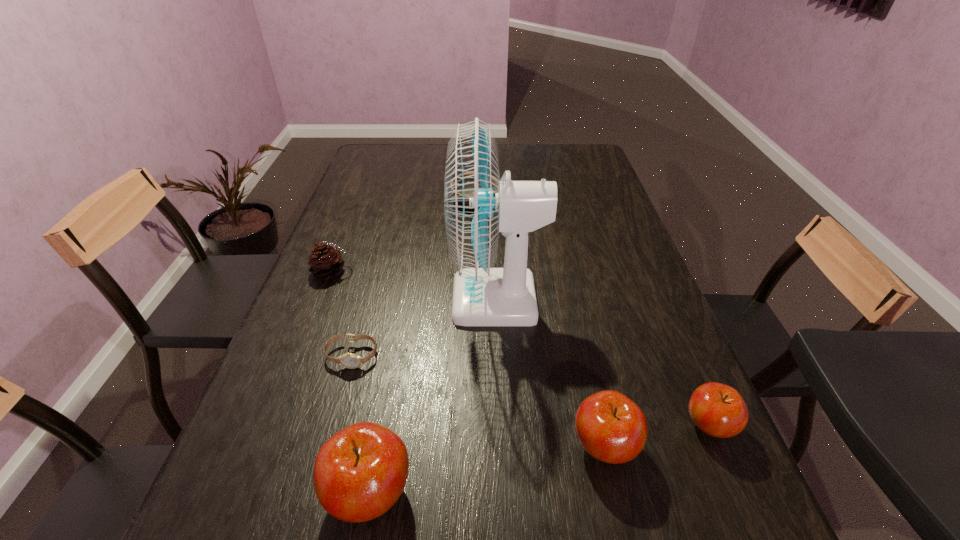
Find the location of `the tallest apple`. the tallest apple is located at coordinates (360, 472).

Where is `the second tallest object`? the second tallest object is located at coordinates (360, 472).

This screenshot has height=540, width=960. In order to click on the second object from right to left in this screenshot , I will do `click(612, 428)`.

Where is `the second apple from left to right`? This screenshot has width=960, height=540. the second apple from left to right is located at coordinates (612, 428).

Locate an element on the screen. This screenshot has height=540, width=960. the rightmost apple is located at coordinates (718, 410).

The image size is (960, 540). Identify the location of the shortest apple. (718, 410).

Identify the location of the tallest object. The width and height of the screenshot is (960, 540). (478, 205).

I want to click on fan, so click(x=478, y=205).

Identify the location of the shortest object. (348, 360).

At what (x,y) coordinates should I click in order to perform the action: click on pinecone. Please return your answer as a coordinate pair (x, y). The width and height of the screenshot is (960, 540). Looking at the image, I should click on (325, 261).